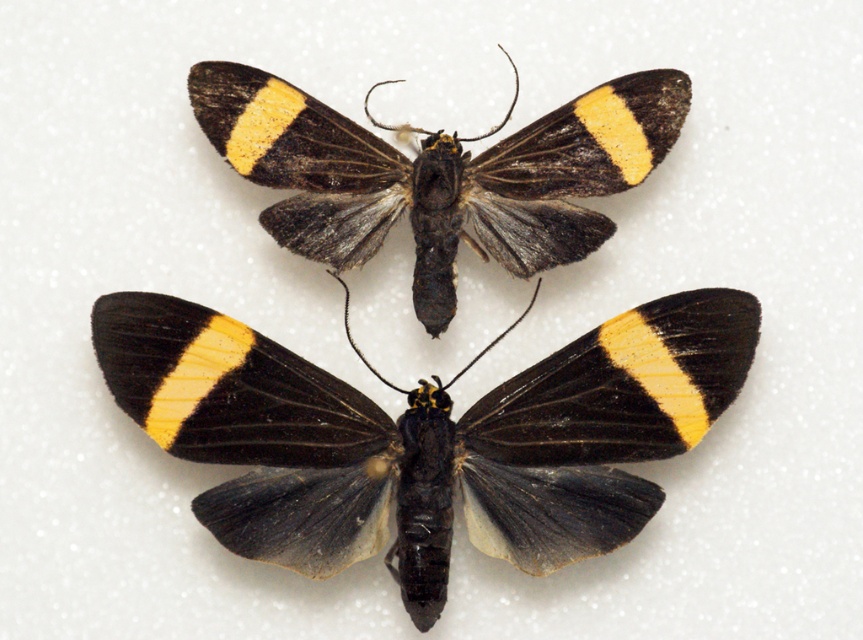
Question: Is black matte butterfly at center smaller than black/yellow striped moth at center?

Choices:
 (A) yes
 (B) no

Answer: (B)

Question: Can you confirm if black matte butterfly at center is positioned to the right of black/yellow striped moth at center?

Choices:
 (A) no
 (B) yes

Answer: (A)

Question: Is black matte butterfly at center bigger than black/yellow striped moth at center?

Choices:
 (A) yes
 (B) no

Answer: (A)

Question: Which point is farther to the camera?

Choices:
 (A) black matte butterfly at center
 (B) black/yellow striped moth at center

Answer: (B)

Question: Which of the following is the farthest from the observer?

Choices:
 (A) black matte butterfly at center
 (B) black/yellow striped moth at center

Answer: (B)